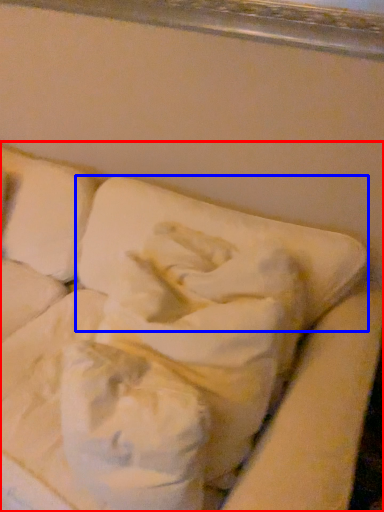
Question: Among these objects, which one is farthest to the camera, furniture (highlighted by a red box) or pillow (highlighted by a blue box)?

Choices:
 (A) furniture
 (B) pillow

Answer: (B)